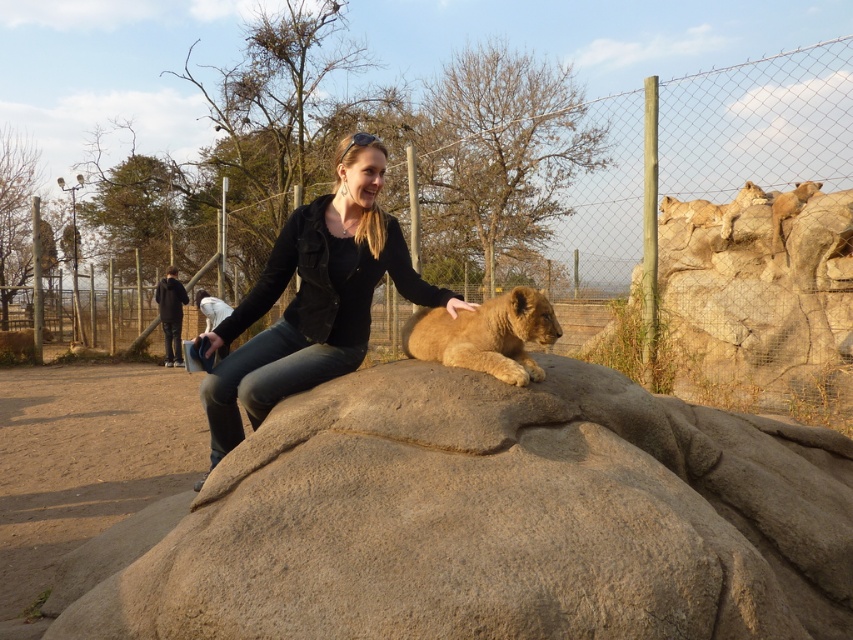
Question: Which is farther from the smooth sandstone boulder at center?

Choices:
 (A) black leather jacket at center
 (B) golden fur lion at upper right
 (C) golden fur lion cub at center

Answer: (B)

Question: Estimate the real-world distances between objects in this image. Which object is closer to the smooth sandstone boulder at center?

Choices:
 (A) black leather jacket at center
 (B) golden fur lion cub at center

Answer: (B)

Question: Does smooth sandstone boulder at center have a smaller size compared to black leather jacket at center?

Choices:
 (A) no
 (B) yes

Answer: (A)

Question: Is smooth sandstone boulder at center smaller than golden fur lion at upper right?

Choices:
 (A) no
 (B) yes

Answer: (A)

Question: Which point is closer to the camera taking this photo?

Choices:
 (A) (685, 220)
 (B) (693, 566)

Answer: (B)

Question: Is smooth sandstone boulder at center below golden fur lion cub at center?

Choices:
 (A) yes
 (B) no

Answer: (A)